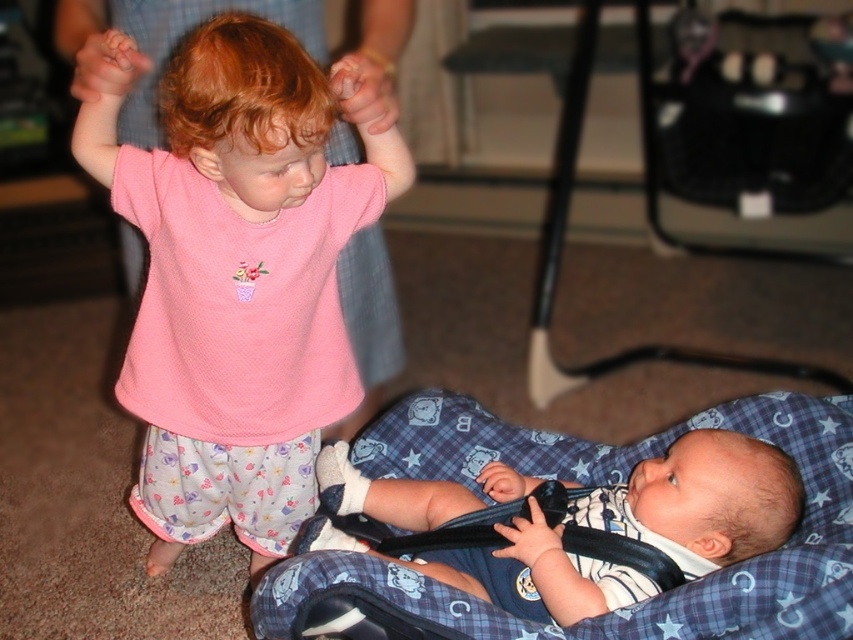
Who is more distant from viewer, (260, 499) or (695, 536)?

The point (260, 499) is behind.

Where is `pink mesh shirt at upper left`? Image resolution: width=853 pixels, height=640 pixels. pink mesh shirt at upper left is located at coordinates [x=242, y=269].